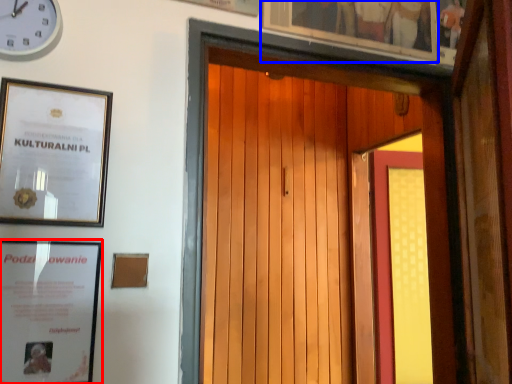
Question: Which object is closer to the camera taking this photo, picture frame (highlighted by a red box) or picture frame (highlighted by a blue box)?

Choices:
 (A) picture frame
 (B) picture frame

Answer: (A)